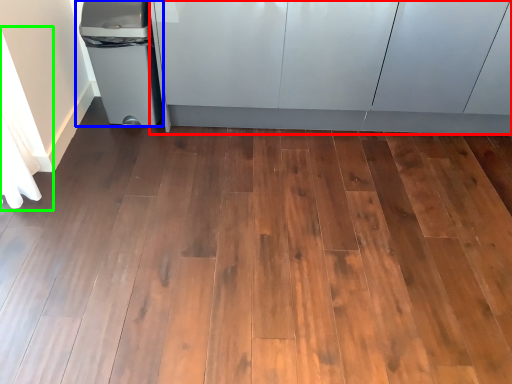
Question: Considering the real-world distances, which object is farthest from cabinetry (highlighted by a red box)? waste container (highlighted by a blue box) or curtain (highlighted by a green box)?

Choices:
 (A) waste container
 (B) curtain

Answer: (B)